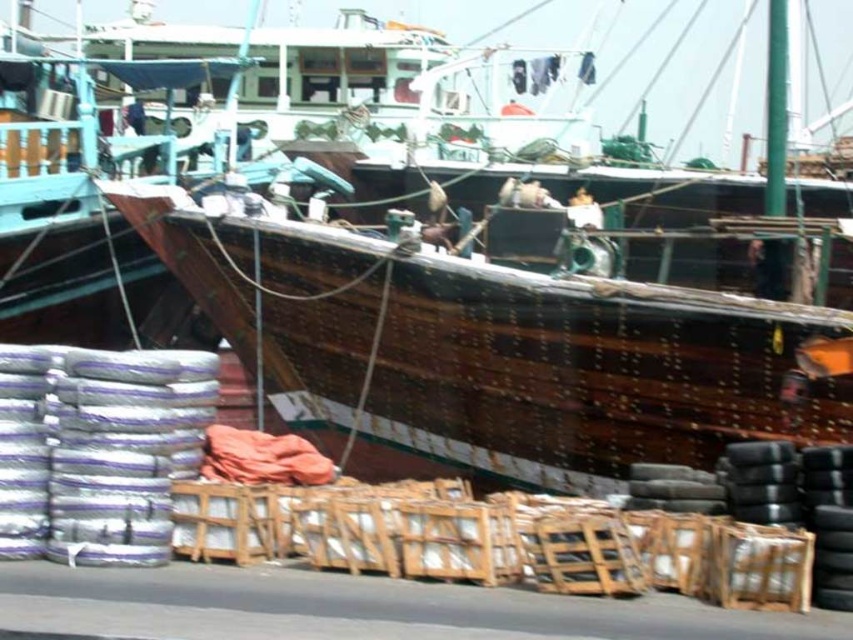
You are a dock worker who needs to move the black rubber tires at lower right to the storage area. Since the wooden boat at center is in the way, can you move the tires around it without lifting them? Explain your reasoning.

The black rubber tires at lower right are behind the wooden boat at center, so you can move them around the boat by going around its sides or the back since they are already positioned behind it.